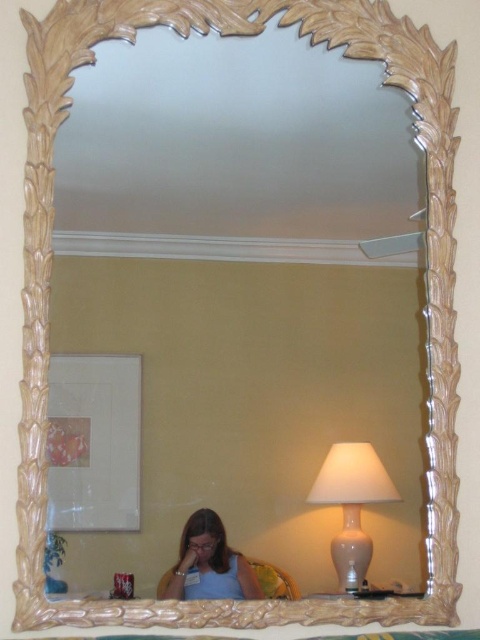
Question: Can you confirm if white glossy lamp at lower right is positioned to the right of matte blue shirt at lower center?

Choices:
 (A) yes
 (B) no

Answer: (A)

Question: Does white glossy lamp at lower right appear over matte blue shirt at lower center?

Choices:
 (A) no
 (B) yes

Answer: (B)

Question: Which point is farther from the camera taking this photo?

Choices:
 (A) (216, 580)
 (B) (361, 492)

Answer: (B)

Question: In this image, where is white glossy lamp at lower right located relative to matte blue shirt at lower center?

Choices:
 (A) below
 (B) above

Answer: (B)